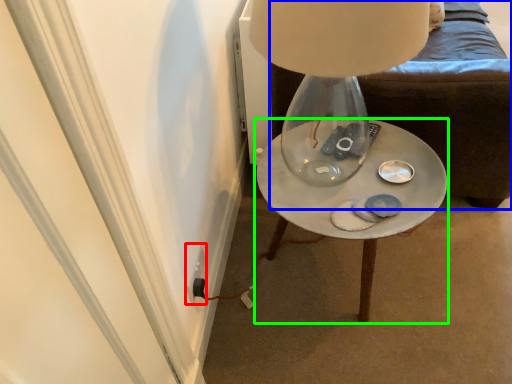
Question: Which object is the farthest from electric outlet (highlighted by a red box)? Choose among these: furniture (highlighted by a blue box) or table (highlighted by a green box).

Choices:
 (A) furniture
 (B) table

Answer: (A)